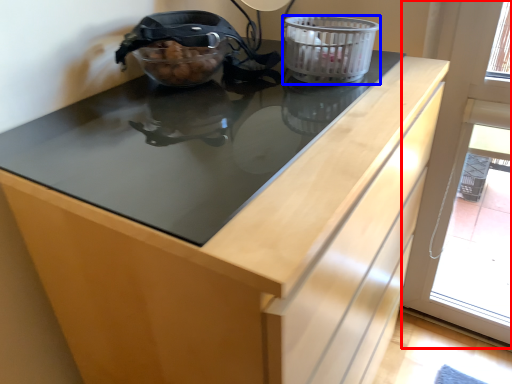
Question: Which of the following is the farthest to the observer, screen door (highlighted by a red box) or basket container (highlighted by a blue box)?

Choices:
 (A) screen door
 (B) basket container

Answer: (A)